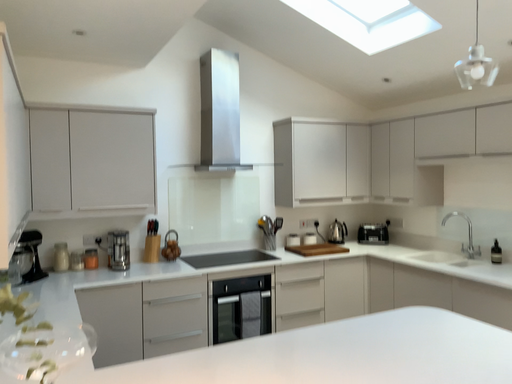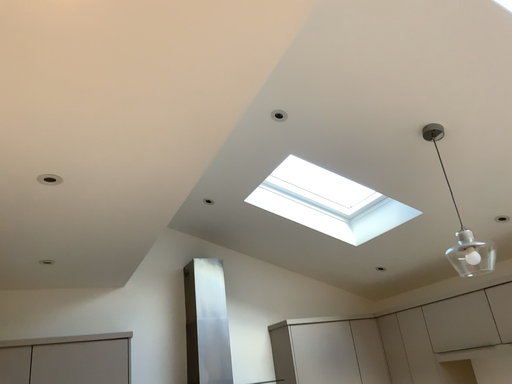
Question: Which way did the camera rotate in the video?

Choices:
 (A) rotated downward
 (B) rotated upward

Answer: (B)